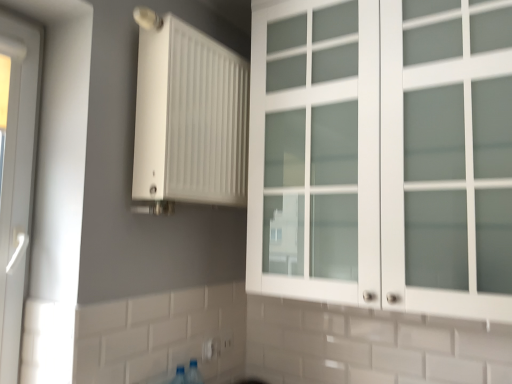
Question: Choose the correct answer: Is white plastic electric outlet at lower center, arranged as the 1th electric outlet when viewed from the left, inside white frosted glass cabinet at upper right or outside it?

Choices:
 (A) outside
 (B) inside

Answer: (A)

Question: Based on their sizes in the image, would you say white plastic electric outlet at lower center, the first electric outlet in the front-to-back sequence, is bigger or smaller than white frosted glass cabinet at upper right?

Choices:
 (A) big
 (B) small

Answer: (B)

Question: Which of these objects is positioned closest to the white plastic electric outlet at lower center, which appears as the 2th electric outlet when viewed from the back?

Choices:
 (A) white frosted glass cabinet at upper right
 (B) white matte radiator at upper center
 (C) white plastic electric outlet at lower center, marked as the 1th electric outlet in a back-to-front arrangement
 (D) white plastic door at left

Answer: (C)

Question: Estimate the real-world distances between objects in this image. Which object is closer to the white matte radiator at upper center?

Choices:
 (A) white plastic electric outlet at lower center, which is the 2th electric outlet in front-to-back order
 (B) white plastic door at left
 (C) white frosted glass cabinet at upper right
 (D) white plastic electric outlet at lower center, acting as the 2th electric outlet starting from the right

Answer: (C)